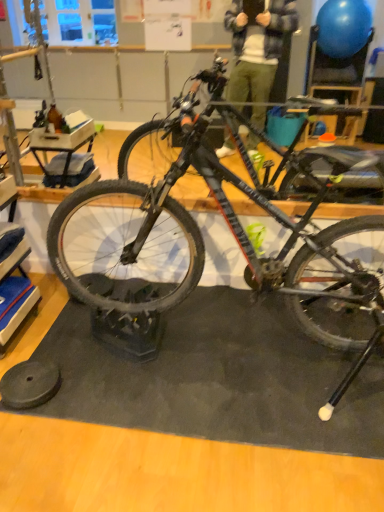
What do you see at coordinates (29, 384) in the screenshot?
I see `black rubber wheel at lower left` at bounding box center [29, 384].

The width and height of the screenshot is (384, 512). Find the location of `black rubber wheel at lower left`. black rubber wheel at lower left is located at coordinates (29, 384).

Considering the relative positions of black rubber wheel at lower left and matte black bicycle at center in the image provided, is black rubber wheel at lower left to the left of matte black bicycle at center from the viewer's perspective?

Correct, you'll find black rubber wheel at lower left to the left of matte black bicycle at center.

Measure the distance from black rubber wheel at lower left to matte black bicycle at center.

A distance of 36.29 inches exists between black rubber wheel at lower left and matte black bicycle at center.

Image resolution: width=384 pixels, height=512 pixels. Identify the location of wheel on the left side of matte black bicycle at center. (29, 384).

Would you consider black rubber wheel at lower left to be distant from matte black bicycle at center?

→ They are positioned close to each other.

Is matte black bicycle at center bigger than black rubber wheel at lower left?

Correct, matte black bicycle at center is larger in size than black rubber wheel at lower left.

Is matte black bicycle at center far away from black rubber wheel at lower left?

No, matte black bicycle at center is not far from black rubber wheel at lower left.

In the scene shown: Could black rubber wheel at lower left be considered to be inside matte black bicycle at center?

No, black rubber wheel at lower left is located outside of matte black bicycle at center.

From the image's perspective, is matte black bicycle at center positioned above or below black rubber wheel at lower left?

matte black bicycle at center is above black rubber wheel at lower left.

Which point is more forward, (316, 284) or (60, 224)?

Point (60, 224)

From the image's perspective, which one is positioned higher, shiny black tire at center or matte black bicycle at center?

matte black bicycle at center appears higher in the image.

Is shiny black tire at center positioned in front of matte black bicycle at center?

No, shiny black tire at center is behind matte black bicycle at center.

Is shiny black tire at center inside or outside of matte black bicycle at center?

shiny black tire at center exists entirely within matte black bicycle at center.

From the image's perspective, which is below, black rubber wheel at lower left or shiny black tire at center?

black rubber wheel at lower left, from the image's perspective.

From a real-world perspective, is black rubber wheel at lower left positioned under shiny black tire at center based on gravity?

Yes, from a real-world perspective, black rubber wheel at lower left is under shiny black tire at center.

What's the angular difference between black rubber wheel at lower left and shiny black tire at center's facing directions?

The angle between the facing direction of black rubber wheel at lower left and the facing direction of shiny black tire at center is 90 degrees.

Can you confirm if black rubber wheel at lower left is thinner than shiny black tire at center?

Yes.

From a real-world perspective, is matte black bicycle at center beneath shiny black tire at center?

No, from a real-world perspective, matte black bicycle at center is not under shiny black tire at center.

From the image's perspective, between matte black bicycle at center and shiny black tire at center, who is located below?

shiny black tire at center, from the image's perspective.

Is point (92, 236) farther from camera compared to point (346, 314)?

Yes, point (92, 236) is behind point (346, 314).

Does matte black bicycle at center have a greater width compared to shiny black tire at center?

Indeed, matte black bicycle at center has a greater width compared to shiny black tire at center.

Between shiny black tire at center and black rubber wheel at lower left, which one has larger width?

shiny black tire at center.

Who is taller, shiny black tire at center or black rubber wheel at lower left?

Standing taller between the two is shiny black tire at center.

Would you say shiny black tire at center is outside black rubber wheel at lower left?

Absolutely, shiny black tire at center is external to black rubber wheel at lower left.

In terms of size, does shiny black tire at center appear bigger or smaller than black rubber wheel at lower left?

A: Clearly, shiny black tire at center is larger in size than black rubber wheel at lower left.

Locate an element on the screen. This screenshot has width=384, height=512. bicycle to the right of black rubber wheel at lower left is located at coordinates (231, 231).

Where is `wheel lying behind the matte black bicycle at center`? wheel lying behind the matte black bicycle at center is located at coordinates (29, 384).

Based on their spatial positions, is shiny black tire at center or matte black bicycle at center closer to black rubber wheel at lower left?

Among the two, matte black bicycle at center is located nearer to black rubber wheel at lower left.

Estimate the real-world distances between objects in this image. Which object is further from shiny black tire at center, black rubber wheel at lower left or matte black bicycle at center?

black rubber wheel at lower left is further to shiny black tire at center.

From the image, which object appears to be nearer to black rubber wheel at lower left, matte black bicycle at center or shiny black tire at center?

Among the two, matte black bicycle at center is located nearer to black rubber wheel at lower left.

From the image, which object appears to be farther from shiny black tire at center, matte black bicycle at center or black rubber wheel at lower left?

Among the two, black rubber wheel at lower left is located further to shiny black tire at center.

Considering their positions, is black rubber wheel at lower left positioned further to matte black bicycle at center than shiny black tire at center?

Among the two, black rubber wheel at lower left is located further to matte black bicycle at center.

Considering their positions, is shiny black tire at center positioned closer to matte black bicycle at center than black rubber wheel at lower left?

shiny black tire at center is closer to matte black bicycle at center.

Find the location of `bicycle situated between black rubber wheel at lower left and shiny black tire at center from left to right`. bicycle situated between black rubber wheel at lower left and shiny black tire at center from left to right is located at coordinates (231, 231).